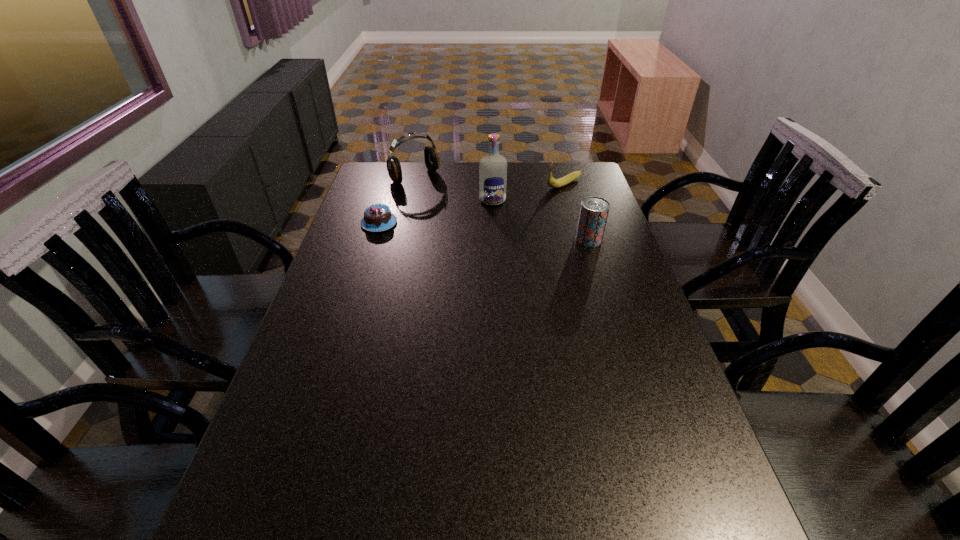
Identify which object is located as the third nearest to the fourth shortest object. Please provide its 2D coordinates. Your answer should be formatted as a tuple, i.e. [(x, y)], where the tuple contains the x and y coordinates of a point satisfying the conditions above.

[(552, 182)]

Select which object appears as the fourth closest to the chocolate cake. Please provide its 2D coordinates. Your answer should be formatted as a tuple, i.e. [(x, y)], where the tuple contains the x and y coordinates of a point satisfying the conditions above.

[(594, 210)]

Find the location of a particular element. vacant region that satisfies the following two spatial constraints: 1. on the back side of the shortest object; 2. on the right side of the third nearest object is located at coordinates (386, 200).

The image size is (960, 540). What are the coordinates of `free space that satisfies the following two spatial constraints: 1. on the front side of the third tallest object; 2. on the right side of the second shortest object` in the screenshot? It's located at click(580, 239).